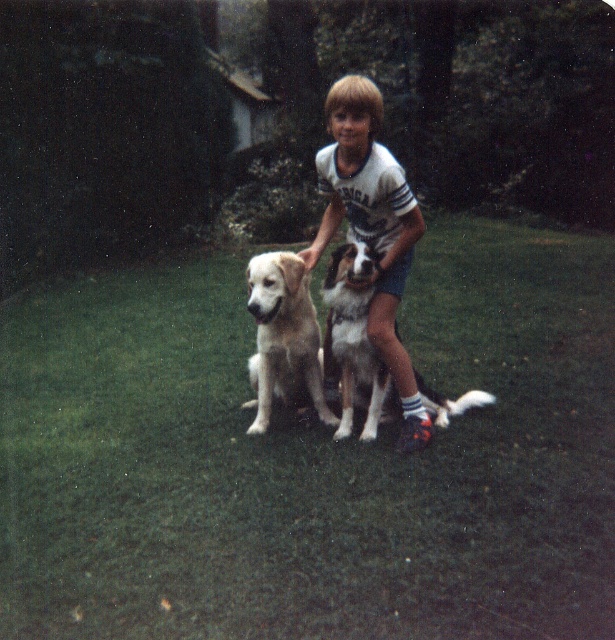
You are a photographer trying to capture a photo of the scene. You want to ensure that both points, point [552,330] and point [308,252], are in focus. Since you can only focus on one point at a time, which point should you choose to ensure the other point is also in focus?

You should focus on point [308,252] because it is closer to the viewer than point [552,330]. Focusing on the closer point will result in a deeper depth of field, making both points in focus.

In the scene shown: You are a photographer trying to capture a photo of the green grass at center and the light brown fur at center. You need to ensure that both subjects are in focus simultaneously. Given that your camera has a depth of field that can cover a maximum distance of 1.5 meters between objects, will you be able to achieve this?

The green grass at center and light brown fur at center are 1.66 meters apart from each other. Since the distance between them exceeds the camera depth of field limit of 1.5 meters, it will be challenging to have both in focus at the same time.